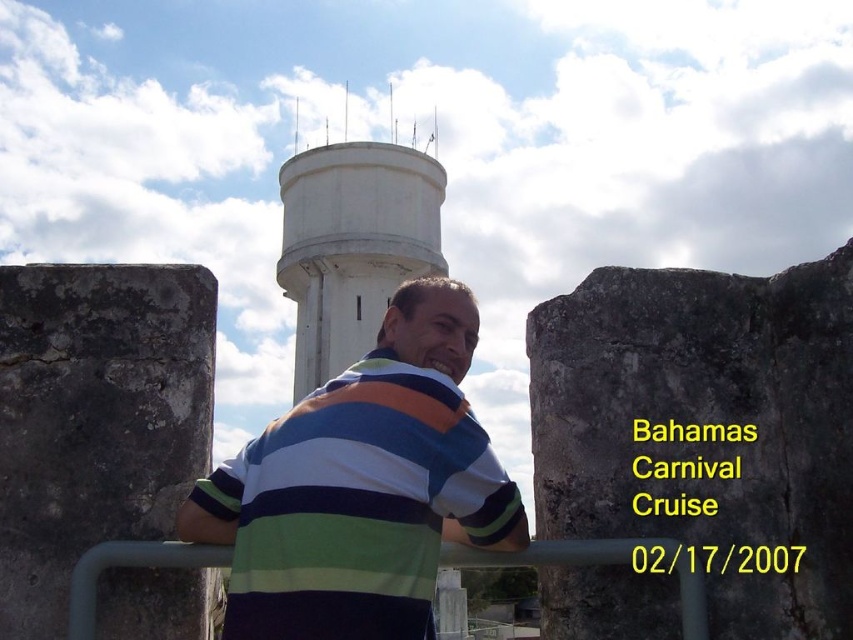
Question: Which of the following is the farthest from the observer?

Choices:
 (A) green matte rail at center
 (B) striped cotton shirt at center
 (C) gray rough stone pillar at left

Answer: (C)

Question: Which point is closer to the camera?

Choices:
 (A) striped cotton shirt at center
 (B) gray rough stone at center
 (C) gray rough stone pillar at left
 (D) white concrete water tower at center

Answer: (A)

Question: Can you confirm if white concrete water tower at center is wider than green matte rail at center?

Choices:
 (A) no
 (B) yes

Answer: (B)

Question: Which point appears closest to the camera in this image?

Choices:
 (A) (590, 545)
 (B) (27, 288)

Answer: (A)

Question: Where is gray rough stone pillar at left located in relation to green matte rail at center in the image?

Choices:
 (A) right
 (B) left

Answer: (B)

Question: Is gray rough stone pillar at left positioned behind white concrete water tower at center?

Choices:
 (A) yes
 (B) no

Answer: (B)